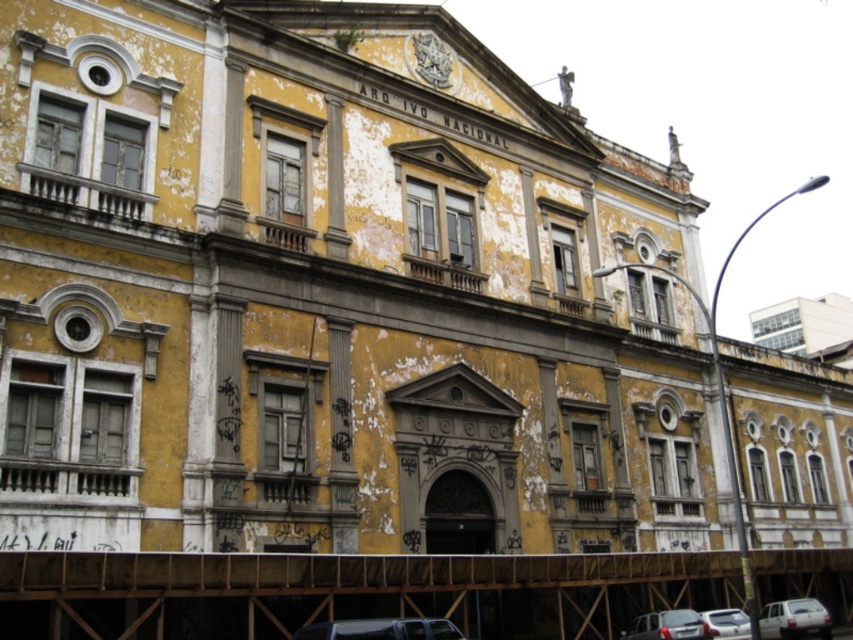
Question: Which point appears farthest from the camera in this image?

Choices:
 (A) (677, 612)
 (B) (419, 634)
 (C) (804, 618)
 (D) (718, 611)

Answer: (C)

Question: Which point appears closest to the camera in this image?

Choices:
 (A) (746, 628)
 (B) (315, 637)
 (C) (641, 636)
 (D) (773, 634)

Answer: (B)

Question: Does metallic silver car at lower center appear over white matte car at lower right?

Choices:
 (A) no
 (B) yes

Answer: (B)

Question: Is the position of white matte car at lower right more distant than that of silver metallic car at lower right?

Choices:
 (A) no
 (B) yes

Answer: (B)

Question: Can you confirm if metallic silver car at lower center is bigger than white matte car at lower right?

Choices:
 (A) no
 (B) yes

Answer: (A)

Question: Which point is farther to the camera?

Choices:
 (A) (445, 621)
 (B) (723, 618)

Answer: (B)